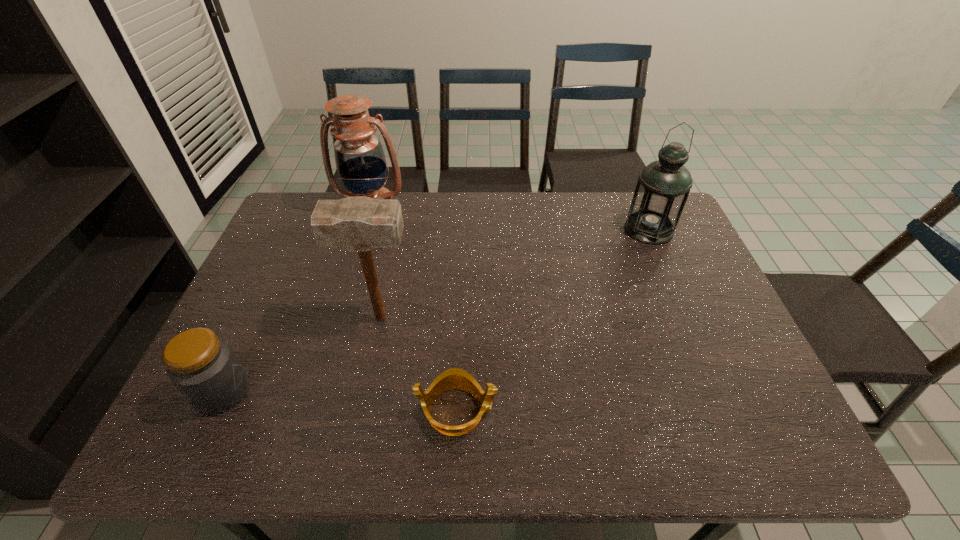
The width and height of the screenshot is (960, 540). I want to click on empty space that is in between the shortest object and the right oil lamp, so click(553, 320).

Locate an element on the screen. vacant region between the right oil lamp and the left oil lamp is located at coordinates (510, 220).

Identify which object is the fourth nearest to the right oil lamp. Please provide its 2D coordinates. Your answer should be formatted as a tuple, i.e. [(x, y)], where the tuple contains the x and y coordinates of a point satisfying the conditions above.

[(203, 367)]

Identify which object is the fourth nearest to the second object from right to left. Please provide its 2D coordinates. Your answer should be formatted as a tuple, i.e. [(x, y)], where the tuple contains the x and y coordinates of a point satisfying the conditions above.

[(663, 186)]